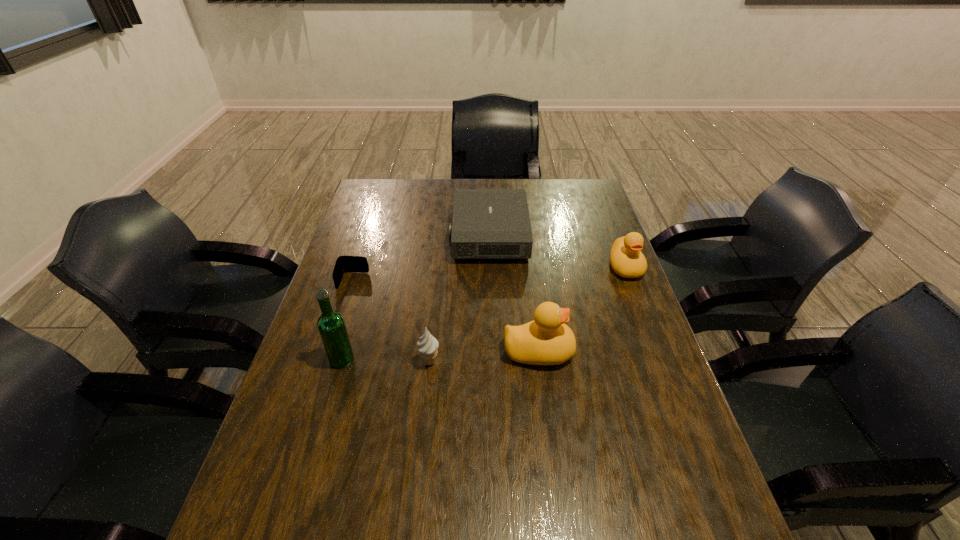
Identify the location of the left duck. The width and height of the screenshot is (960, 540). (547, 340).

The width and height of the screenshot is (960, 540). In order to click on the second tallest object in this screenshot , I will do `click(547, 340)`.

You are a GUI agent. You are given a task and a screenshot of the screen. Output one action in this format:
    pyautogui.click(x=<x>, y=<y>)
    Task: Click on the farther duck
    The image size is (960, 540).
    Given the screenshot: What is the action you would take?
    pyautogui.click(x=626, y=259)

Locate an element on the screen. the shorter duck is located at coordinates (626, 259).

Image resolution: width=960 pixels, height=540 pixels. Find the location of `the tallest object`. the tallest object is located at coordinates (331, 325).

Locate an element on the screen. The image size is (960, 540). icecream is located at coordinates (428, 345).

Where is `the second shortest object`? This screenshot has height=540, width=960. the second shortest object is located at coordinates pyautogui.click(x=487, y=223).

Find the location of a particular element. This screenshot has height=540, width=960. the shortest object is located at coordinates (343, 264).

Where is `vacant area located 0.110m on the face of the second tallest object`? The width and height of the screenshot is (960, 540). vacant area located 0.110m on the face of the second tallest object is located at coordinates (616, 352).

What are the coordinates of `free space located on the face of the farther duck` in the screenshot? It's located at (644, 316).